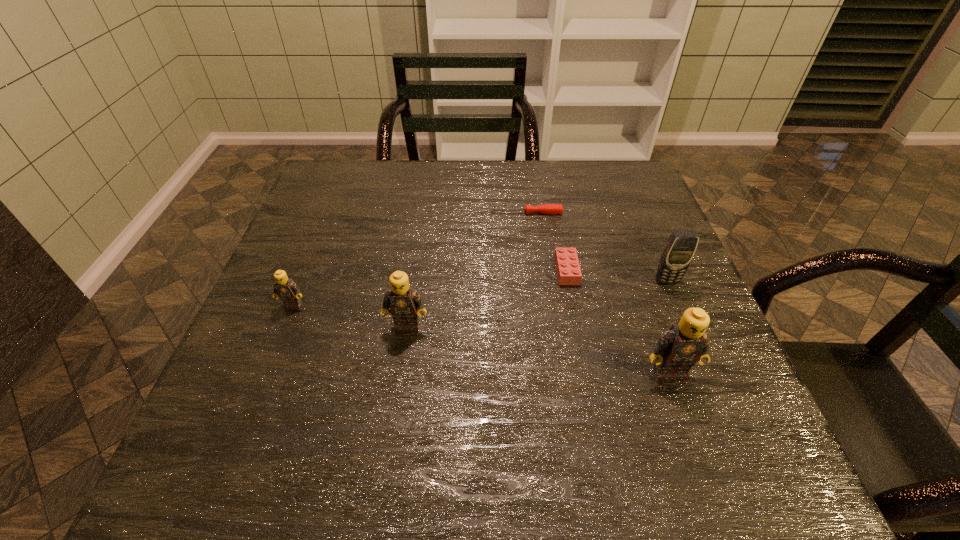
To make them evenly spaced by inserting another Lego among them, please locate a free space for this new Lego. Please provide its 2D coordinates. Your answer should be formatted as a tuple, i.e. [(x, y)], where the tuple contains the x and y coordinates of a point satisfying the conditions above.

[(532, 348)]